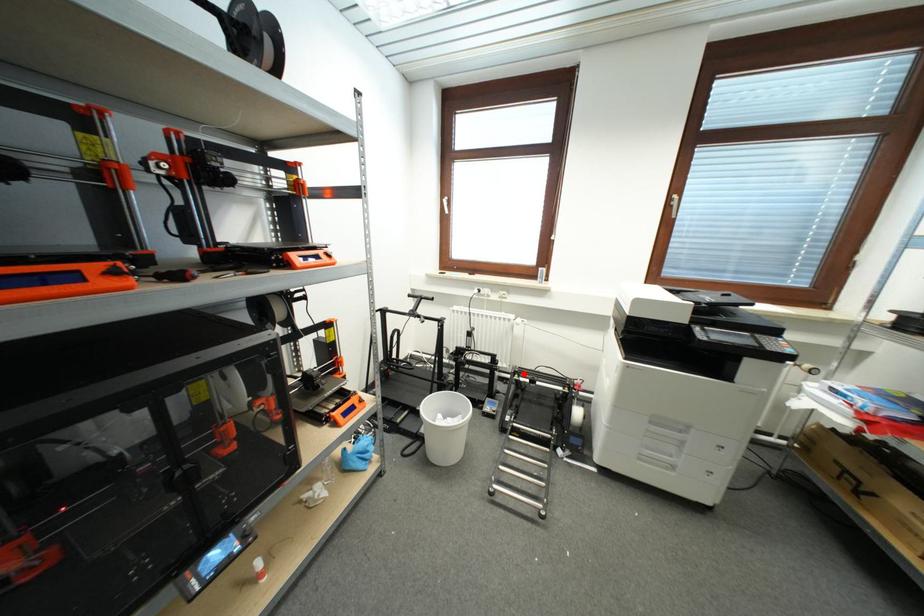
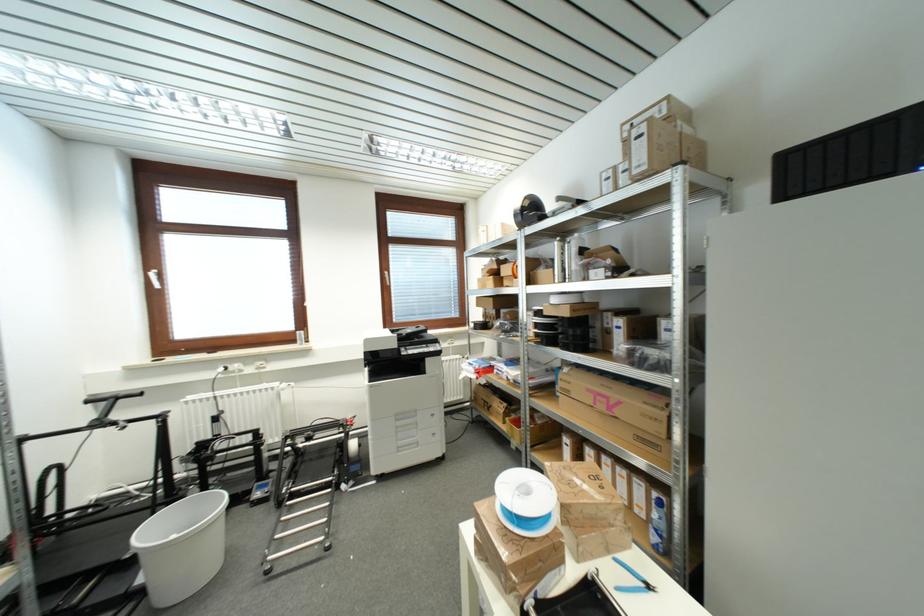
Find the pixel in the second image that matches the highlighted location in the first image.

(297, 438)